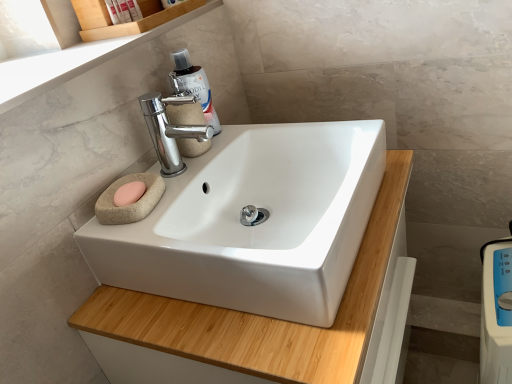
Where is `vacant space to the right of white plastic bottle at upper left, acting as the 2th toiletry starting from the left`? Image resolution: width=512 pixels, height=384 pixels. vacant space to the right of white plastic bottle at upper left, acting as the 2th toiletry starting from the left is located at coordinates point(173,16).